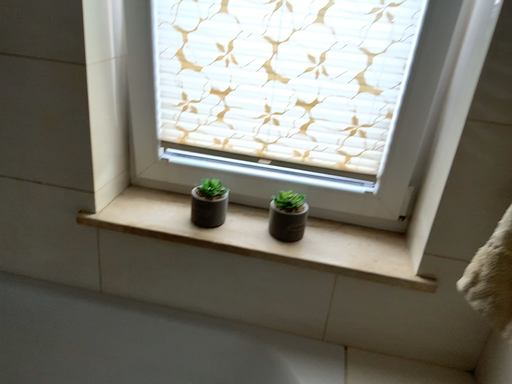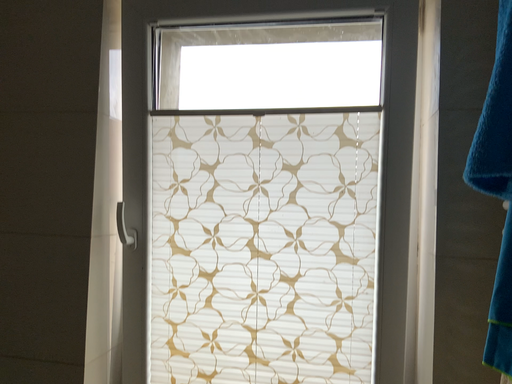
Question: Which way did the camera rotate in the video?

Choices:
 (A) rotated upward
 (B) rotated downward

Answer: (A)